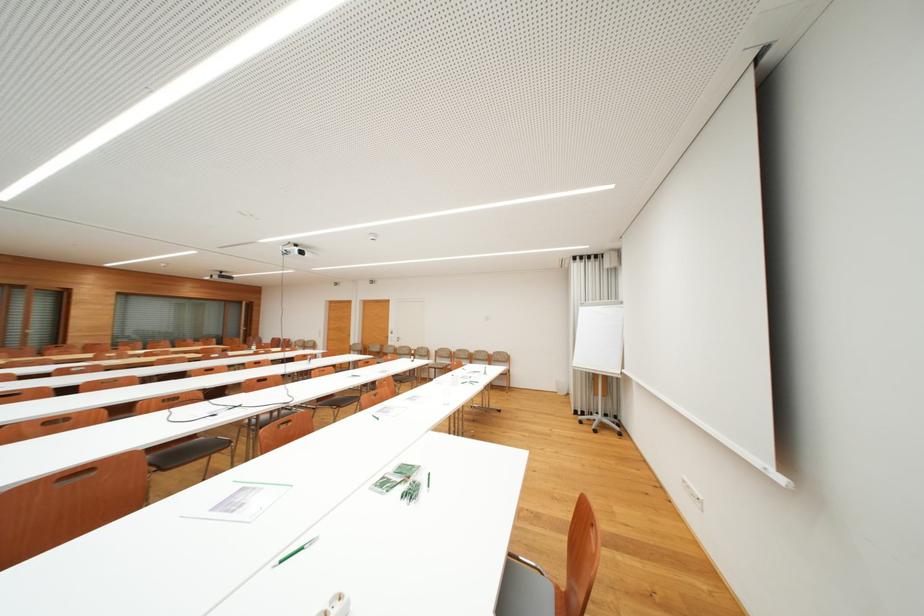
The location [296,551] corresponds to which object?

It corresponds to the green pen in the image.